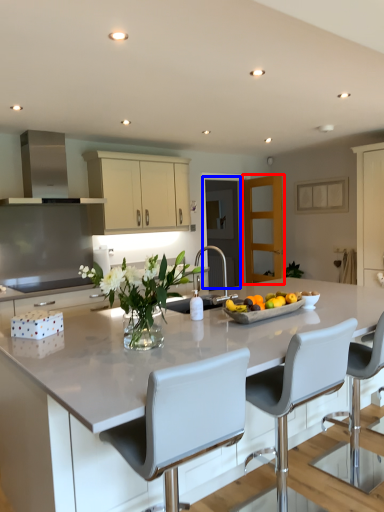
Question: Which of the following is the closest to the observer, glass door (highlighted by a red box) or glass door (highlighted by a blue box)?

Choices:
 (A) glass door
 (B) glass door

Answer: (A)